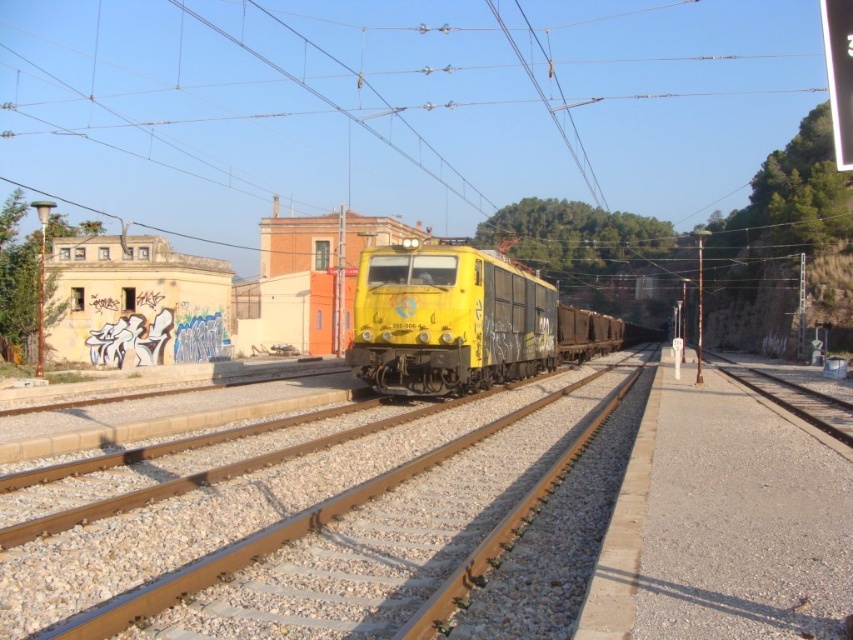
Question: Which point appears farthest from the camera in this image?

Choices:
 (A) (502, 342)
 (B) (68, 620)

Answer: (A)

Question: Among these points, which one is farthest from the camera?

Choices:
 (A) (543, 316)
 (B) (80, 636)

Answer: (A)

Question: Does yellow metal train at center have a greater width compared to yellow matte train at center?

Choices:
 (A) yes
 (B) no

Answer: (B)

Question: Is yellow metal train at center above yellow matte train at center?

Choices:
 (A) no
 (B) yes

Answer: (A)

Question: Where is yellow metal train at center located in relation to yellow matte train at center in the image?

Choices:
 (A) left
 (B) right

Answer: (A)